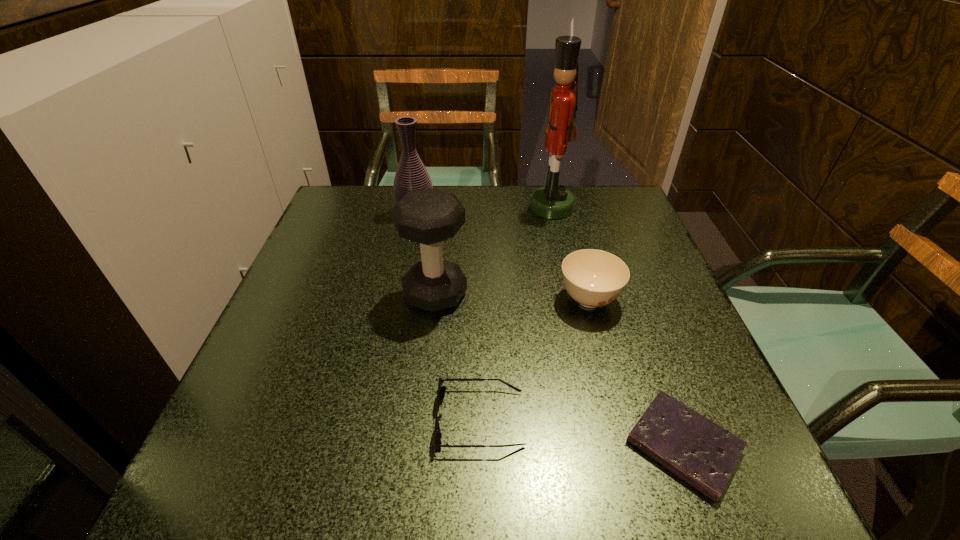
The width and height of the screenshot is (960, 540). Identify the location of nutcracker. (553, 201).

Locate an element on the screen. The height and width of the screenshot is (540, 960). vase is located at coordinates (411, 175).

Locate an element on the screen. This screenshot has width=960, height=540. dumbbell is located at coordinates (429, 216).

The width and height of the screenshot is (960, 540). What are the coordinates of `sugar bowl` in the screenshot? It's located at (594, 278).

At what (x,y) coordinates should I click in order to perform the action: click on the second shortest object. Please return your answer as a coordinate pair (x, y). Looking at the image, I should click on click(x=441, y=389).

Locate an element on the screen. The height and width of the screenshot is (540, 960). the shortest object is located at coordinates (703, 454).

Where is `free space located 0.390m on the front-facing side of the tallest object`? free space located 0.390m on the front-facing side of the tallest object is located at coordinates [386, 207].

Locate an element on the screen. Image resolution: width=960 pixels, height=540 pixels. free space located on the front-facing side of the tallest object is located at coordinates (496, 207).

Locate an element on the screen. The height and width of the screenshot is (540, 960). vacant space situated 0.260m on the front-facing side of the tallest object is located at coordinates (434, 207).

The width and height of the screenshot is (960, 540). Identify the location of vacant space situated 0.210m on the right of the vase. (514, 212).